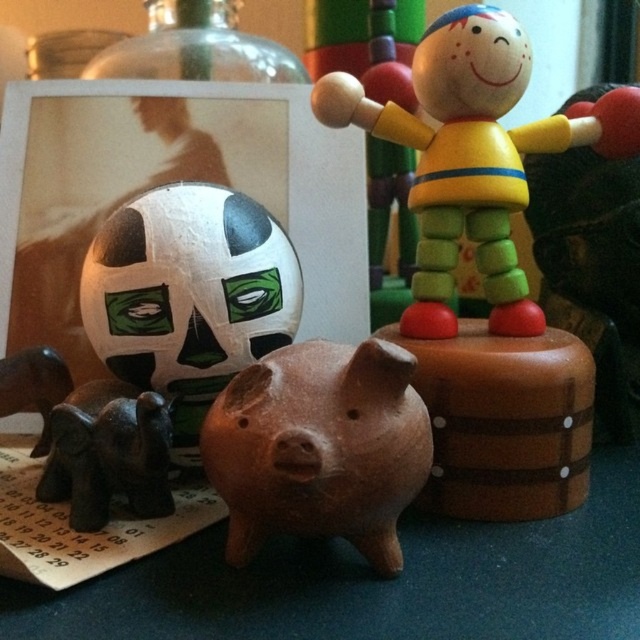
Question: Based on their relative distances, which object is farther from the wooden figure at upper right?

Choices:
 (A) transparent glass bottle at upper left
 (B) brown matte piggy bank at center

Answer: (A)

Question: Which object is farther from the camera taking this photo?

Choices:
 (A) brown matte piggy bank at center
 (B) dark brown wooden elephant at lower left
 (C) wooden figure at upper right

Answer: (C)

Question: Which point is farther to the camera?

Choices:
 (A) (237, 33)
 (B) (442, 182)
 (C) (88, 496)

Answer: (A)

Question: In this image, where is brown matte piggy bank at center located relative to dark brown wooden elephant at lower left?

Choices:
 (A) below
 (B) above

Answer: (B)

Question: Is wooden figure at upper right below brown matte piggy bank at center?

Choices:
 (A) no
 (B) yes

Answer: (A)

Question: Where is dark brown wooden elephant at lower left located in relation to transparent glass bottle at upper left in the image?

Choices:
 (A) below
 (B) above

Answer: (A)